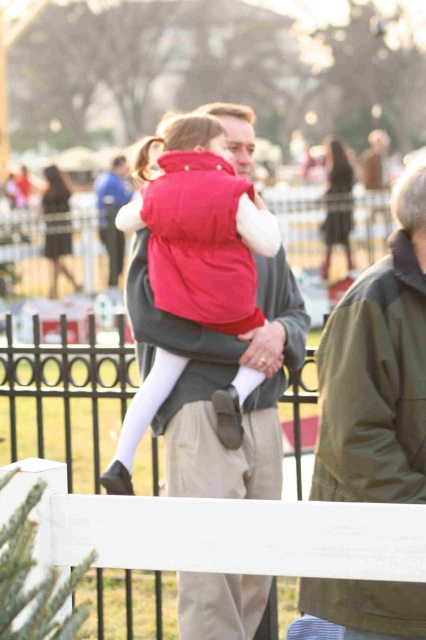
You are a tailor who needs to compare the width of the khaki fabric jacket at right and the matte red vest at center. Which one is wider?

The matte red vest at center is wider than the khaki fabric jacket at right.

You are standing in the park and want to take a photo of the two points marked in the image. Which point, point (340, 385) or point (111, 209), is closer to your camera lens?

Point (340, 385) is closer to the camera lens than point (111, 209).

You are standing in the park and see a man holding a girl. There is a point marked at coordinates [377,369]. What object is located at this point?

The point at [377,369] marks the khaki fabric jacket at right.